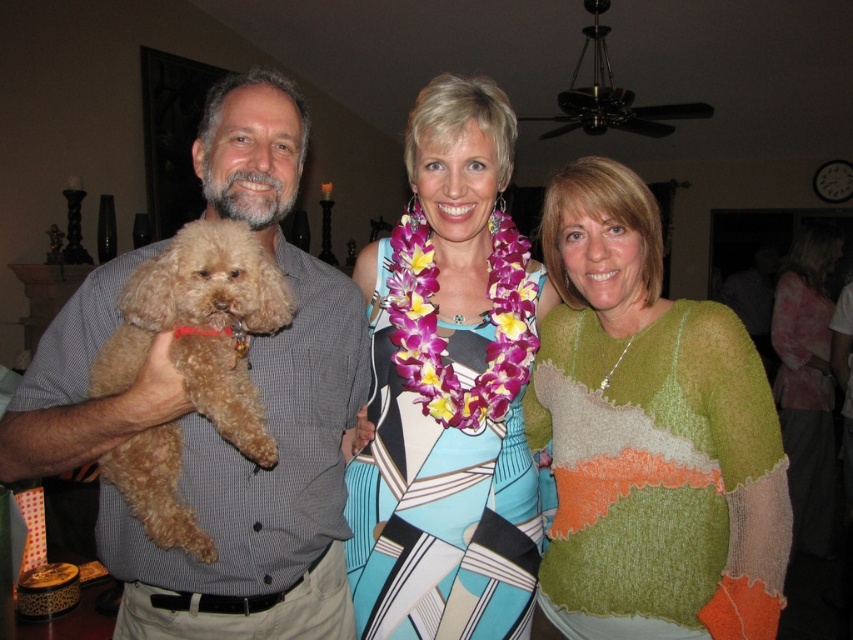
Question: Where is knitted green sweater at right located in relation to green textured sweater at center in the image?

Choices:
 (A) right
 (B) left

Answer: (B)

Question: Which point is closer to the camera?

Choices:
 (A) printed fabric dress at center
 (B) matte brown shirt at center
 (C) green textured sweater at center

Answer: (B)

Question: Is knitted green sweater at right further to the viewer compared to light brown fur at center?

Choices:
 (A) no
 (B) yes

Answer: (B)

Question: Which point appears farthest from the camera in this image?

Choices:
 (A) (161, 273)
 (B) (144, 595)
 (C) (828, 384)

Answer: (C)

Question: Estimate the real-world distances between objects in this image. Which object is closer to the matte brown shirt at center?

Choices:
 (A) knitted green sweater at right
 (B) light brown fur at center

Answer: (B)

Question: Can you confirm if knitted green sweater at right is wider than light brown fur at center?

Choices:
 (A) yes
 (B) no

Answer: (A)